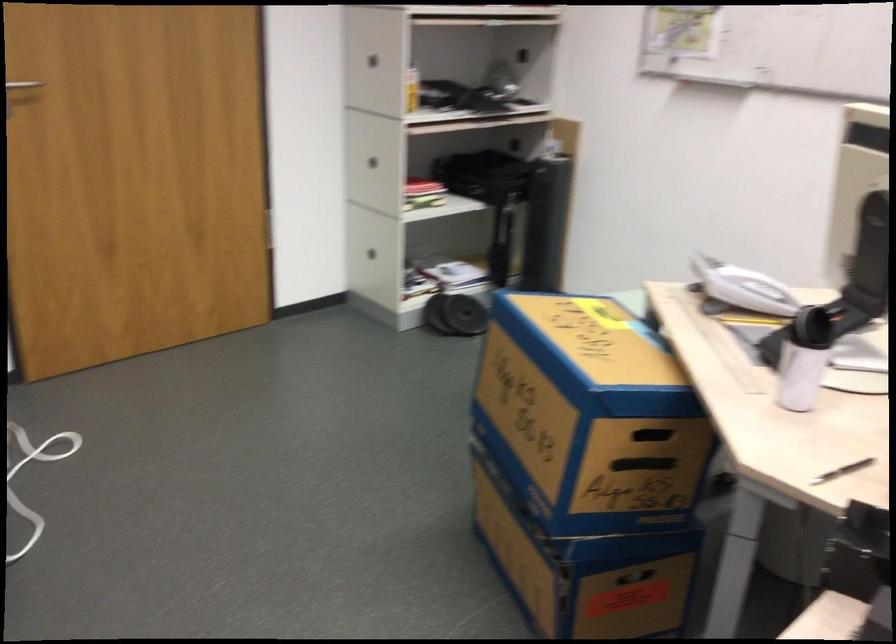
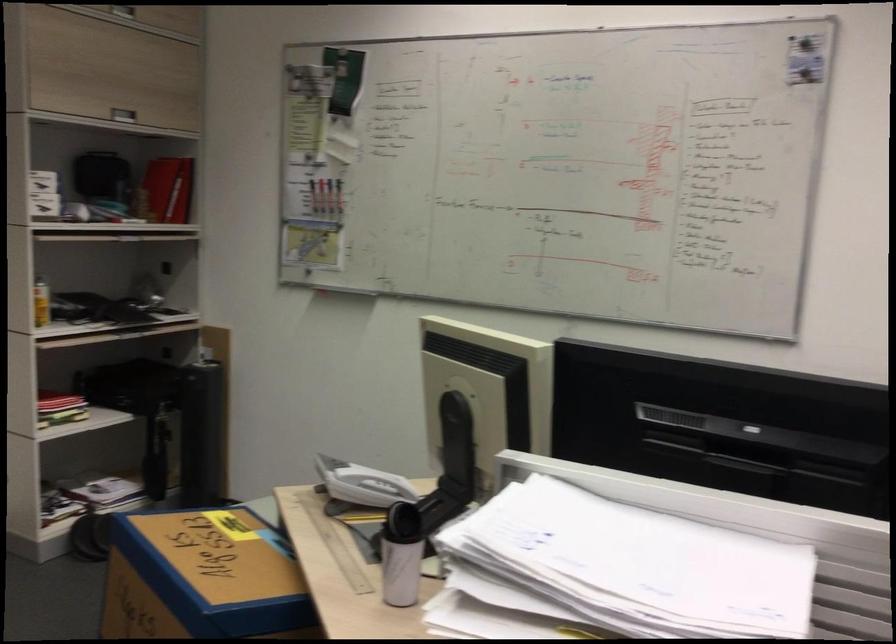
In the second image, find the point that corresponds to (409,87) in the first image.

(40, 303)